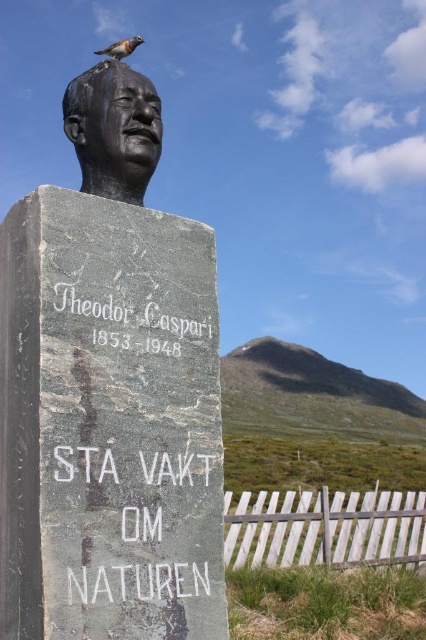
Is bronze bust at upper center thinner than bronze statue at upper center?

Incorrect, bronze bust at upper center's width is not less than bronze statue at upper center's.

Is point (55, 371) closer to viewer compared to point (141, 140)?

Yes, it is in front of point (141, 140).

Does point (129, 326) come farther from viewer compared to point (147, 97)?

No, it is in front of (147, 97).

This screenshot has height=640, width=426. I want to click on bronze bust at upper center, so click(109, 392).

Can you confirm if bronze bust at upper center is positioned below brown speckled feather at upper center?

Yes, bronze bust at upper center is below brown speckled feather at upper center.

Is bronze bust at upper center wider than brown speckled feather at upper center?

In fact, bronze bust at upper center might be narrower than brown speckled feather at upper center.

Which is in front, point (221, 572) or point (121, 49)?

Point (221, 572)

This screenshot has height=640, width=426. Identify the location of bronze bust at upper center. click(109, 392).

Is point (143, 81) more distant than point (111, 52)?

No, it is not.

Between point (126, 124) and point (101, 54), which one is positioned in front?

Point (126, 124) is in front.

This screenshot has height=640, width=426. I want to click on bronze statue at upper center, so click(114, 129).